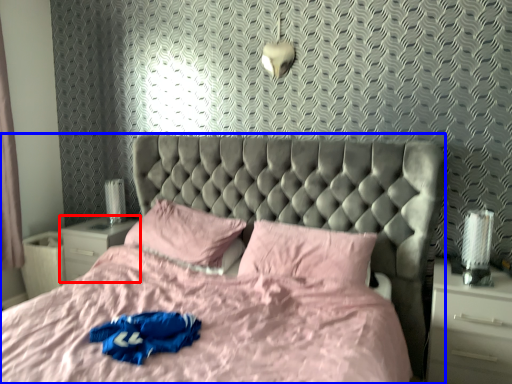
Question: Which object appears farthest to the camera in this image, nightstand (highlighted by a red box) or bed (highlighted by a blue box)?

Choices:
 (A) nightstand
 (B) bed

Answer: (A)